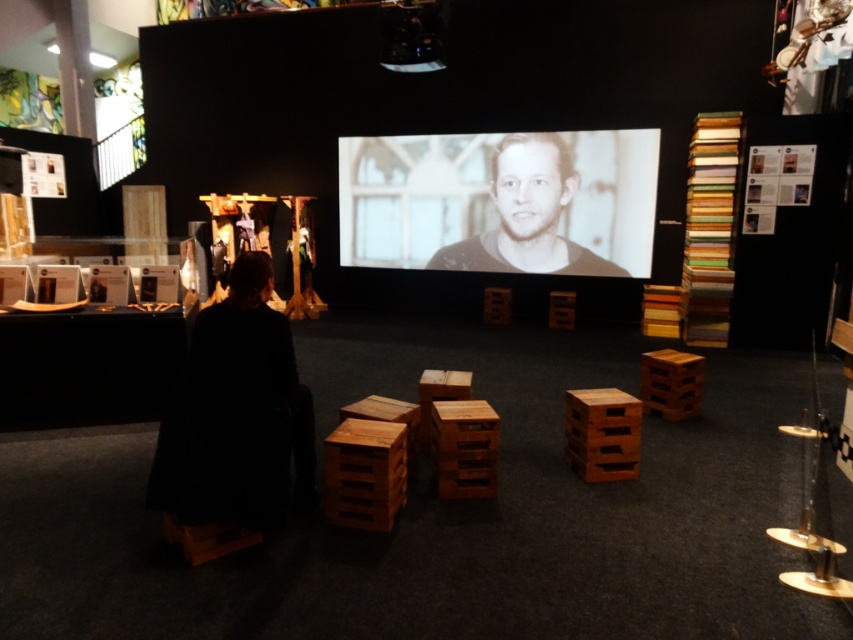
Question: Which point appears farthest from the camera in this image?

Choices:
 (A) (543, 243)
 (B) (328, 493)

Answer: (A)

Question: Which point is closer to the camera taking this photo?

Choices:
 (A) (596, 476)
 (B) (397, 500)
 (C) (506, 161)

Answer: (B)

Question: Among these points, which one is farthest from the camera?

Choices:
 (A) (607, 436)
 (B) (531, 253)
 (C) (404, 461)

Answer: (B)

Question: Can you confirm if black matte face at center is positioned below rustic wood crate at center?

Choices:
 (A) no
 (B) yes

Answer: (A)

Question: Is black matte face at center further to the viewer compared to rustic wood crate at center?

Choices:
 (A) yes
 (B) no

Answer: (A)

Question: Can you confirm if black matte face at center is positioned above brown wooden crate at center?

Choices:
 (A) no
 (B) yes

Answer: (B)